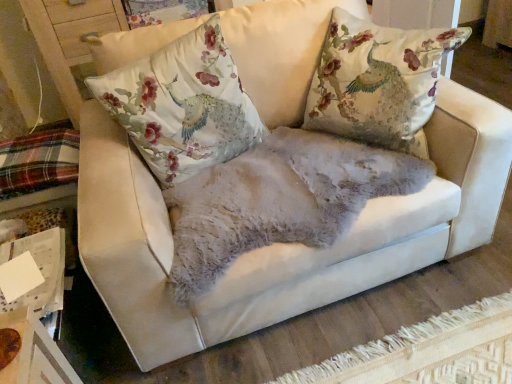
Question: Considering the positions of point (169, 125) and point (53, 178), is point (169, 125) closer or farther from the camera than point (53, 178)?

Choices:
 (A) farther
 (B) closer

Answer: (B)

Question: Do you think silk floral cushion at center is within plaid fabric at lower left, or outside of it?

Choices:
 (A) outside
 (B) inside

Answer: (A)

Question: Looking at the image, does silk floral cushion at center seem bigger or smaller compared to plaid fabric at lower left?

Choices:
 (A) big
 (B) small

Answer: (A)

Question: Based on their positions, is plaid fabric at lower left located to the left or right of silk floral cushion at center?

Choices:
 (A) left
 (B) right

Answer: (A)

Question: Looking at their shapes, would you say plaid fabric at lower left is wider or thinner than silk floral cushion at center?

Choices:
 (A) thin
 (B) wide

Answer: (B)

Question: From the image's perspective, is plaid fabric at lower left located above or below silk floral cushion at center?

Choices:
 (A) above
 (B) below

Answer: (B)

Question: Is plaid fabric at lower left inside the boundaries of silk floral cushion at center, or outside?

Choices:
 (A) inside
 (B) outside

Answer: (B)